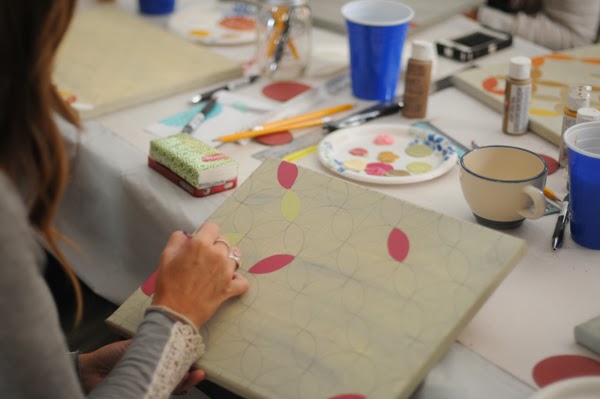
Identify the location of cup. (502, 200).